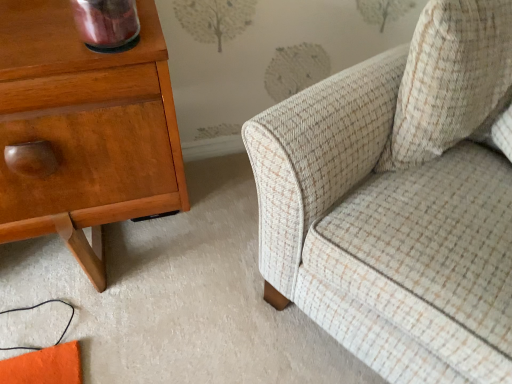
Question: Is beige textured cushion at upper right taller or shorter than shiny wood nightstand at left?

Choices:
 (A) tall
 (B) short

Answer: (B)

Question: Is point (486, 56) positioned closer to the camera than point (100, 283)?

Choices:
 (A) closer
 (B) farther

Answer: (A)

Question: Which is farther from the shiny wood nightstand at left?

Choices:
 (A) beige textured cushion at upper right
 (B) beige tweed sofa at right

Answer: (A)

Question: Estimate the real-world distances between objects in this image. Which object is closer to the shiny wood nightstand at left?

Choices:
 (A) beige textured cushion at upper right
 (B) beige tweed sofa at right

Answer: (B)